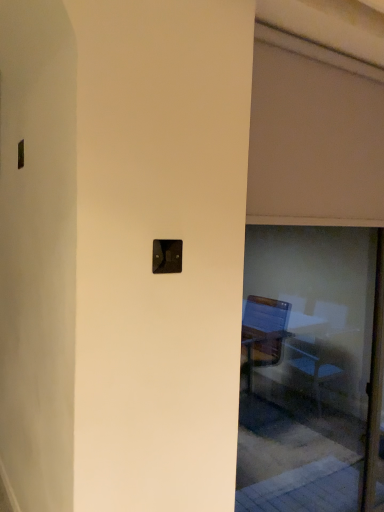
What do you see at coordinates (306, 366) in the screenshot?
I see `matte black door at center` at bounding box center [306, 366].

Where is `matte black door at center`? Image resolution: width=384 pixels, height=512 pixels. matte black door at center is located at coordinates (306, 366).

The width and height of the screenshot is (384, 512). I want to click on matte black door at center, so click(x=306, y=366).